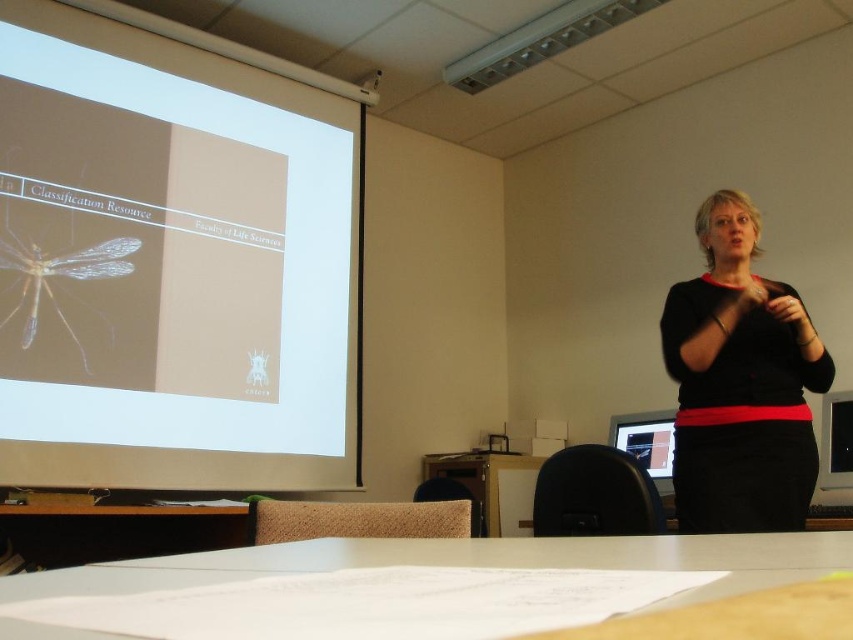
Between white glossy projection screen at upper left and black matte sweater at upper right, which one appears on the left side from the viewer's perspective?

white glossy projection screen at upper left

What do you see at coordinates (172, 264) in the screenshot? Image resolution: width=853 pixels, height=640 pixels. I see `white glossy projection screen at upper left` at bounding box center [172, 264].

Does point (276, 100) lie behind point (764, 317)?

Yes, point (276, 100) is farther from viewer.

This screenshot has height=640, width=853. What are the coordinates of `white glossy projection screen at upper left` in the screenshot? It's located at (172, 264).

Is white glossy projection screen at upper left bigger than translucent yellowishmaterial/texture mosquito at upper left?

Yes, white glossy projection screen at upper left is bigger than translucent yellowishmaterial/texture mosquito at upper left.

Is point (86, 372) farther from viewer compared to point (97, 308)?

No, it is in front of (97, 308).

Which is behind, point (172, 60) or point (33, 236)?

The point (172, 60) is behind.

Locate an element on the screen. This screenshot has width=853, height=640. white glossy projection screen at upper left is located at coordinates tap(172, 264).

Can you confirm if black matte sweater at upper right is positioned to the left of translucent yellowishmaterial/texture mosquito at upper left?

No, black matte sweater at upper right is not to the left of translucent yellowishmaterial/texture mosquito at upper left.

Which is behind, point (805, 321) or point (74, 268)?

The point (74, 268) is behind.

You are a GUI agent. You are given a task and a screenshot of the screen. Output one action in this format:
    pyautogui.click(x=<x>, y=<y>)
    Task: Click on the black matte sweater at upper right
    This screenshot has height=640, width=853.
    Given the screenshot: What is the action you would take?
    pyautogui.click(x=740, y=384)